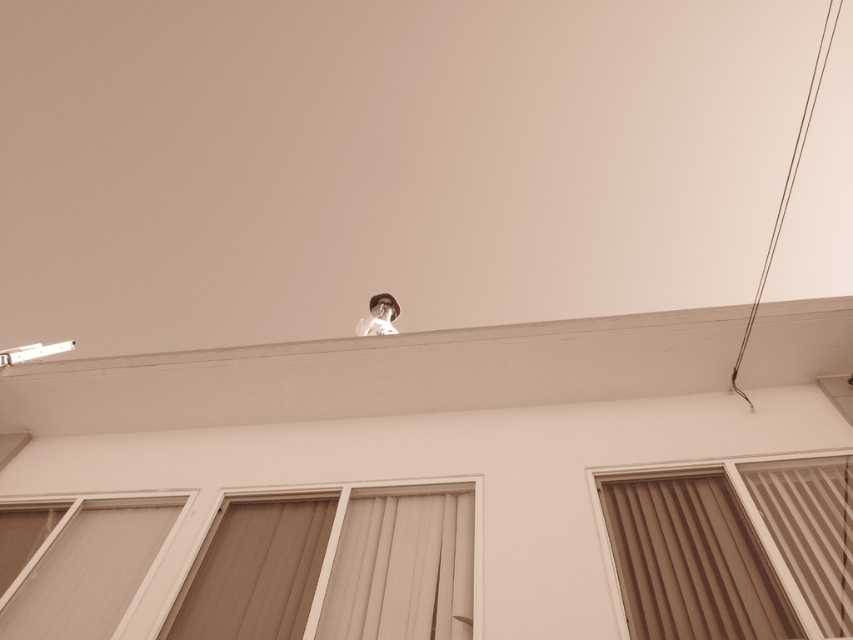
Is beige textured curtain at center shorter than matte glass window at lower left?

Correct, beige textured curtain at center is not as tall as matte glass window at lower left.

Which is more to the right, beige textured curtain at center or matte glass window at lower left?

From the viewer's perspective, beige textured curtain at center appears more on the right side.

Is point (368, 515) farther from viewer compared to point (90, 624)?

Yes, point (368, 515) is behind point (90, 624).

Find the location of a particular element. The width and height of the screenshot is (853, 640). beige textured curtain at center is located at coordinates (402, 568).

The image size is (853, 640). Describe the element at coordinates (730, 548) in the screenshot. I see `matte brown blinds at lower right` at that location.

Which is behind, point (805, 624) or point (7, 611)?

The point (7, 611) is behind.

Identify the location of matte brown blinds at lower right. (730, 548).

The width and height of the screenshot is (853, 640). What do you see at coordinates (402, 568) in the screenshot? I see `beige textured curtain at center` at bounding box center [402, 568].

Does beige textured curtain at center appear on the right side of white glossy portrait at upper center?

Indeed, beige textured curtain at center is positioned on the right side of white glossy portrait at upper center.

Between point (369, 564) and point (378, 316), which one is positioned in front?

Point (369, 564) is more forward.

Identify the location of beige textured curtain at center. The height and width of the screenshot is (640, 853). (402, 568).